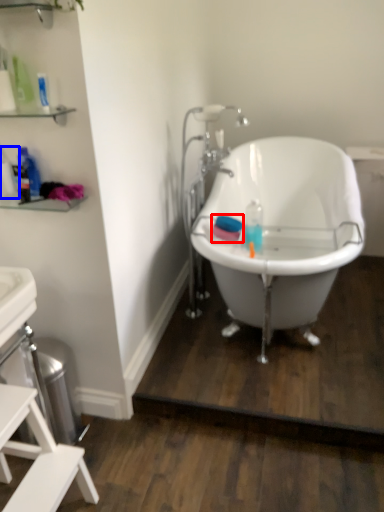
Question: Which object is further to the camera taking this photo, mouthwash (highlighted by a red box) or bottle (highlighted by a blue box)?

Choices:
 (A) mouthwash
 (B) bottle

Answer: (A)